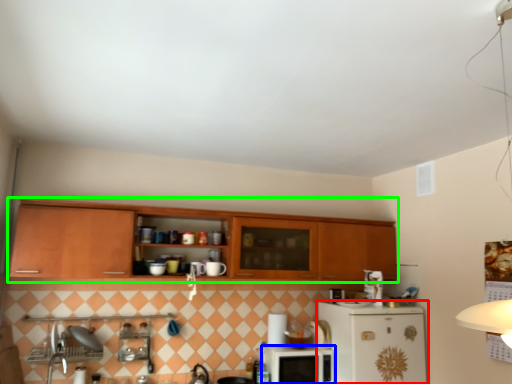
Question: Which object is the farthest from refrigerator (highlighted by a red box)? Choose among these: microwave oven (highlighted by a blue box) or cabinetry (highlighted by a green box).

Choices:
 (A) microwave oven
 (B) cabinetry

Answer: (B)